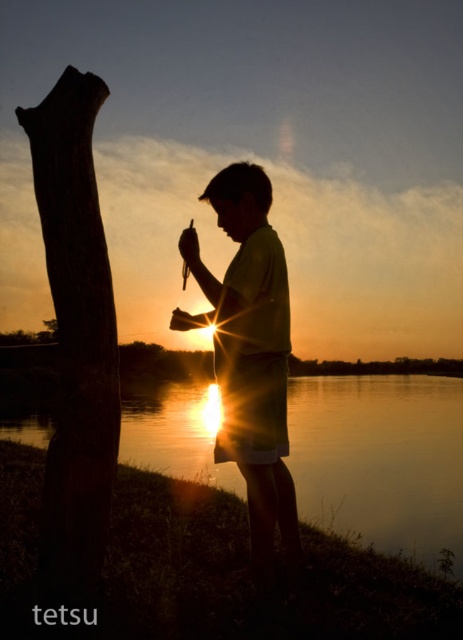
You are standing at the point marked by the coordinates point (381, 460). Looking around, you see the glistening water at lower center. Is the glistening water at lower center located to your left or right side?

The glistening water at lower center is located at point (381, 460), which is the same location you are standing at. Therefore, you are standing on the glistening water at lower center.

You are a photographer trying to capture the sunset reflection on the river. You notice a glistening water at lower center located at point (381,460). Is this point within the river area where the sunset is reflecting?

Yes, the glistening water at lower center is located at point (381,460), which is within the river area where the sunset reflection occurs.

You are a photographer setting up a tripod to capture the sunset reflection on the glistening water at lower center and the silhouette fabric at center. Which object should you position closer to the camera to ensure both are in frame without moving the tripod?

The glistening water at lower center should be positioned closer to the camera since it might be wider than the silhouette fabric at center, ensuring both fit within the frame.